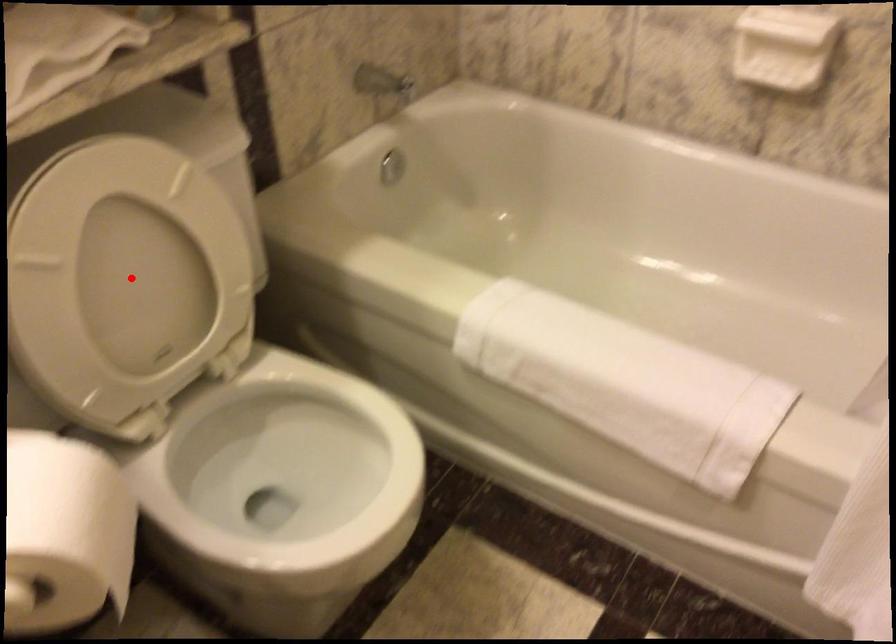
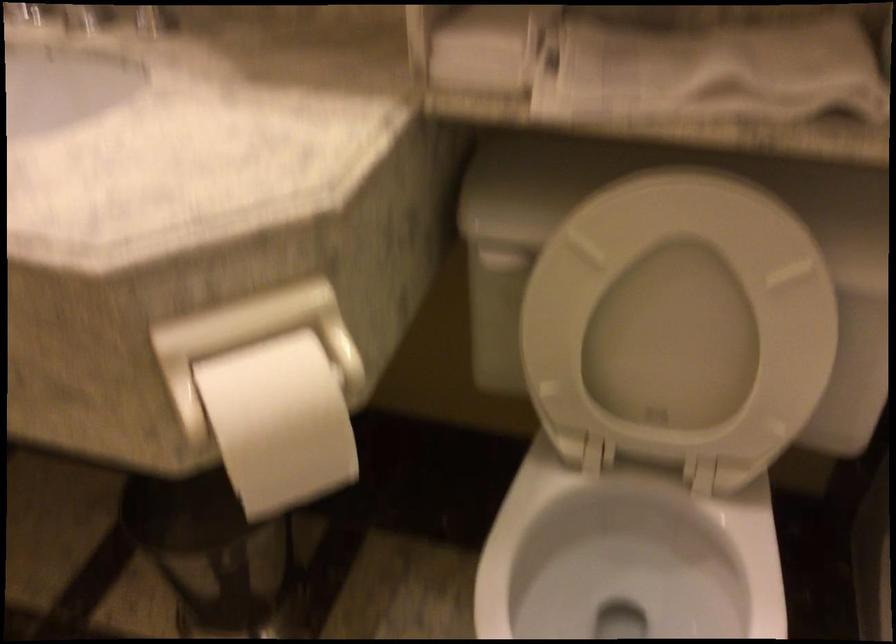
The point at the highlighted location is marked in the first image. Where is the corresponding point in the second image?

(678, 322)